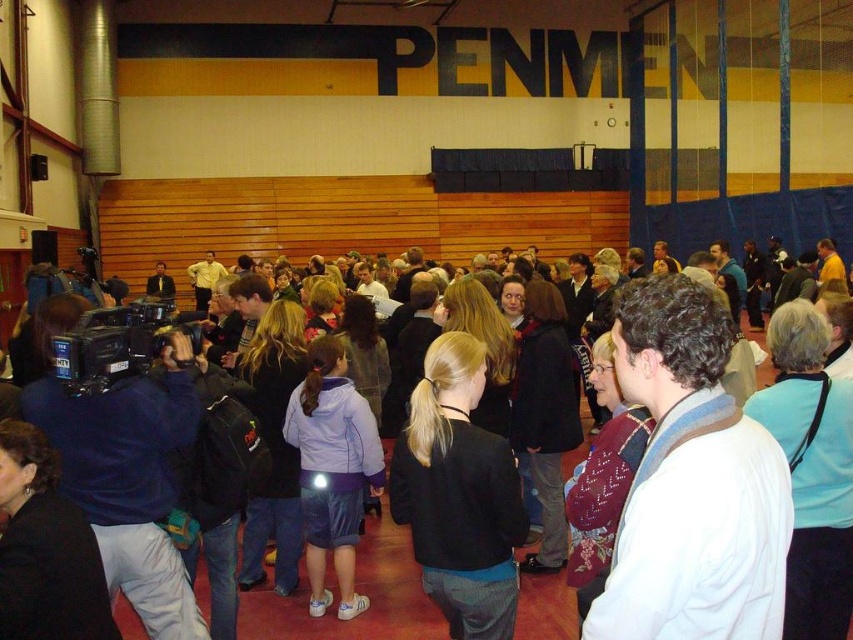
Question: Which point is closer to the camera?

Choices:
 (A) (328, 458)
 (B) (447, 362)

Answer: (B)

Question: Is white wool sweater at center below light purple fleece jacket at center?

Choices:
 (A) no
 (B) yes

Answer: (A)

Question: Is white wool sweater at center wider than black matte jacket at center?

Choices:
 (A) yes
 (B) no

Answer: (B)

Question: Which object appears closest to the camera in this image?

Choices:
 (A) light purple fleece jacket at center
 (B) black matte jacket at center
 (C) white wool sweater at center

Answer: (C)

Question: Does black matte jacket at center appear over light purple fleece jacket at center?

Choices:
 (A) yes
 (B) no

Answer: (A)

Question: Estimate the real-world distances between objects in this image. Which object is farther from the white wool sweater at center?

Choices:
 (A) black matte jacket at center
 (B) light purple fleece jacket at center

Answer: (B)